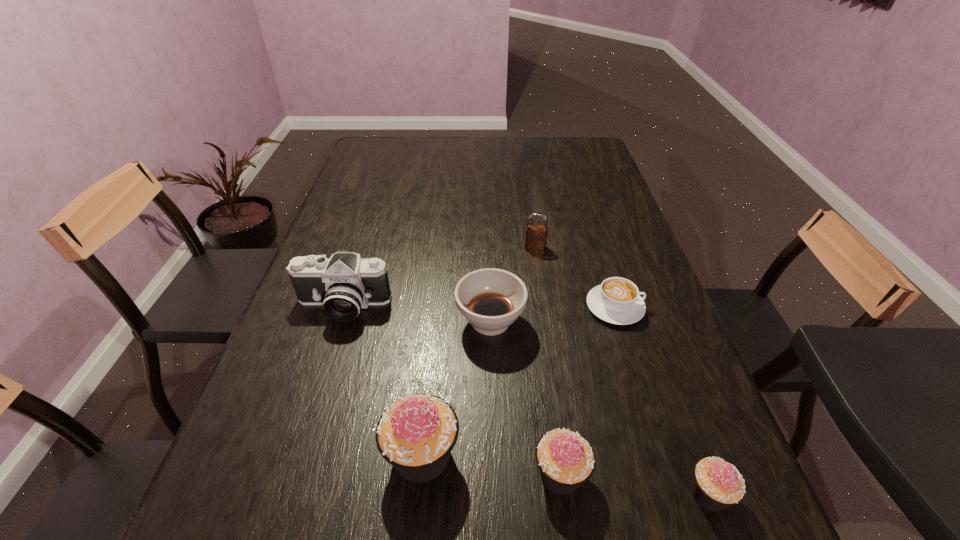
This screenshot has width=960, height=540. What are the coordinates of `vacant position located on the back of the rightmost cupcake` in the screenshot? It's located at (649, 333).

Identify the location of blank space located 0.250m on the front of the leftmost object. The image size is (960, 540). (304, 422).

Identify the location of free space located on the front-facing side of the farthest object. (549, 341).

Where is `free spot located 0.270m on the back of the soup bowl`? free spot located 0.270m on the back of the soup bowl is located at coordinates (489, 233).

Where is `object that is at the left edge`? object that is at the left edge is located at coordinates (344, 284).

I want to click on cupcake that is at the right edge, so click(717, 484).

Where is `cappuccino at the right edge`? The image size is (960, 540). cappuccino at the right edge is located at coordinates (617, 300).

Find the location of a particular element. object located at the near right corner is located at coordinates (717, 484).

Image resolution: width=960 pixels, height=540 pixels. In the image, there is a desktop. Identify the location of vacant space at the far edge. (493, 155).

In order to click on vacant space at the near edge of the desktop in this screenshot , I will do `click(636, 451)`.